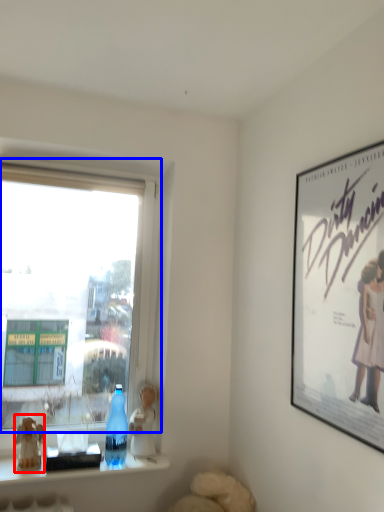
Question: Which point is closer to the camera, figurine (highlighted by a red box) or window (highlighted by a blue box)?

Choices:
 (A) figurine
 (B) window

Answer: (B)